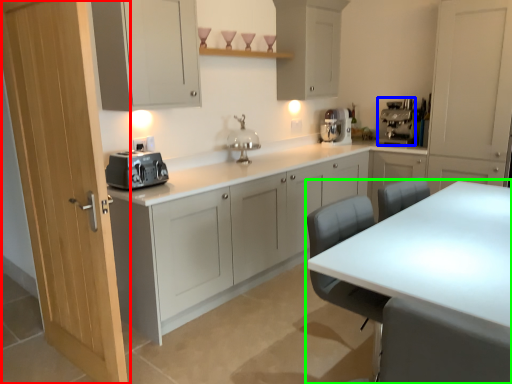
Question: Which object is the closest to the door (highlighted by a red box)? Choose among these: coffee machine (highlighted by a blue box) or table (highlighted by a green box).

Choices:
 (A) coffee machine
 (B) table

Answer: (B)